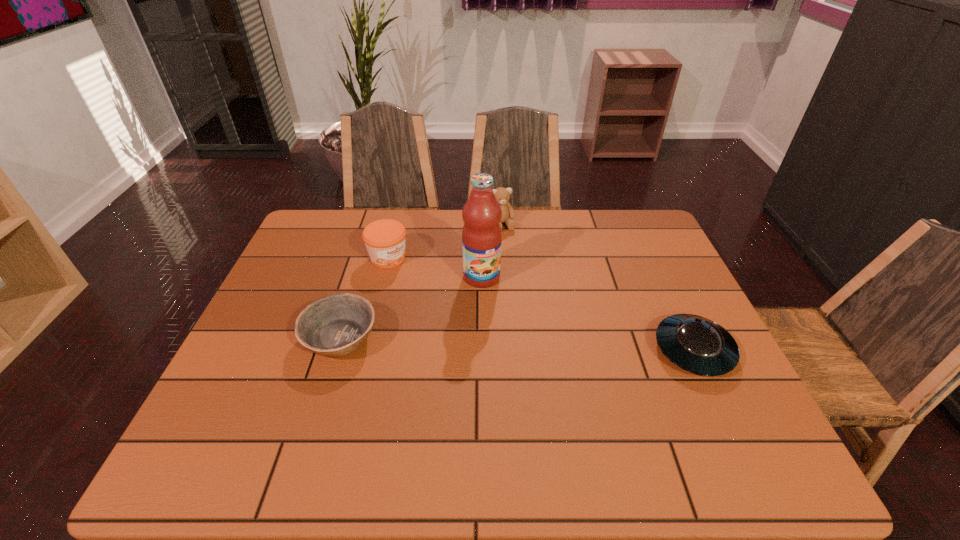
At what (x,y) coordinates should I click in order to perform the action: click on free space between the third shortest object and the tallest object. Please return your answer as a coordinate pair (x, y). This screenshot has height=540, width=960. Looking at the image, I should click on (435, 267).

The height and width of the screenshot is (540, 960). Identify the location of free space between the third tallest object and the fruit juice. (435, 267).

You are a GUI agent. You are given a task and a screenshot of the screen. Output one action in this format:
    pyautogui.click(x=<x>, y=<y>)
    Task: Click on the free spot between the jam and the rightmost object
    Image resolution: width=960 pixels, height=540 pixels.
    Given the screenshot: What is the action you would take?
    pyautogui.click(x=540, y=304)

Identify which object is the nearest to the tallest object. Please provide its 2D coordinates. Your answer should be formatted as a tuple, i.e. [(x, y)], where the tuple contains the x and y coordinates of a point satisfying the conditions above.

[(502, 194)]

The image size is (960, 540). I want to click on the fourth closest object to the farthest object, so click(696, 344).

The image size is (960, 540). I want to click on vacant space that satisfies the following two spatial constraints: 1. on the front side of the rightmost object; 2. on the right side of the teddy bear, so click(510, 350).

Locate an element on the screen. The image size is (960, 540). blank space that satisfies the following two spatial constraints: 1. on the front side of the rightmost object; 2. on the left side of the teddy bear is located at coordinates (510, 350).

Where is `free location that satisfies the following two spatial constraints: 1. on the back side of the teddy bear; 2. on the right side of the tallest object`? This screenshot has width=960, height=540. free location that satisfies the following two spatial constraints: 1. on the back side of the teddy bear; 2. on the right side of the tallest object is located at coordinates (482, 225).